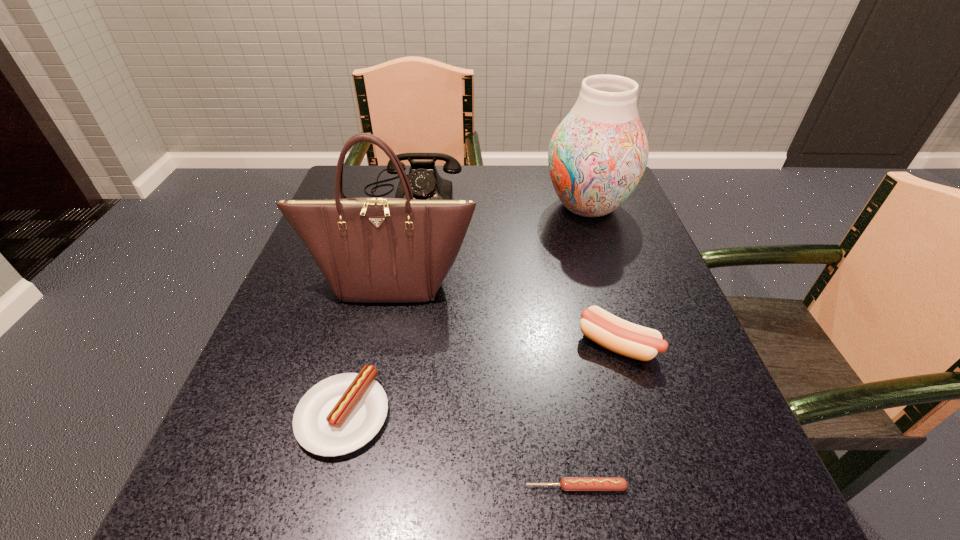
Find the location of a particular element. handbag is located at coordinates (371, 249).

Find the location of a particular element. This screenshot has height=540, width=960. vase is located at coordinates (597, 155).

Image resolution: width=960 pixels, height=540 pixels. Identify the location of telephone. (425, 182).

Locate an element on the screen. the fourth tallest object is located at coordinates (625, 338).

Locate an element on the screen. This screenshot has height=540, width=960. the fourth farthest object is located at coordinates (625, 338).

Locate an element on the screen. The width and height of the screenshot is (960, 540). the second nearest object is located at coordinates (342, 413).

Locate an element on the screen. the second shortest object is located at coordinates (342, 413).

Find the location of `the nearest sausage`. the nearest sausage is located at coordinates (567, 483).

Where is `the shortest object`? Image resolution: width=960 pixels, height=540 pixels. the shortest object is located at coordinates (567, 483).

You are a GUI agent. You are given a task and a screenshot of the screen. Output one action in this format:
    pyautogui.click(x=<x>, y=<y>)
    Task: Click on the vacant space situated 0.170m on the front-facing side of the third farthest object
    The height and width of the screenshot is (540, 960).
    Given the screenshot: What is the action you would take?
    pyautogui.click(x=370, y=381)